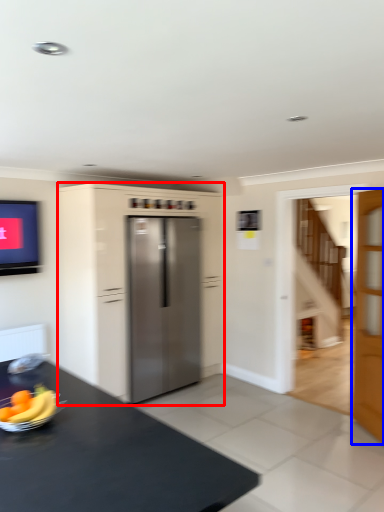
Question: Which object is further to the camera taking this photo, cabinetry (highlighted by a red box) or door (highlighted by a blue box)?

Choices:
 (A) cabinetry
 (B) door

Answer: (A)